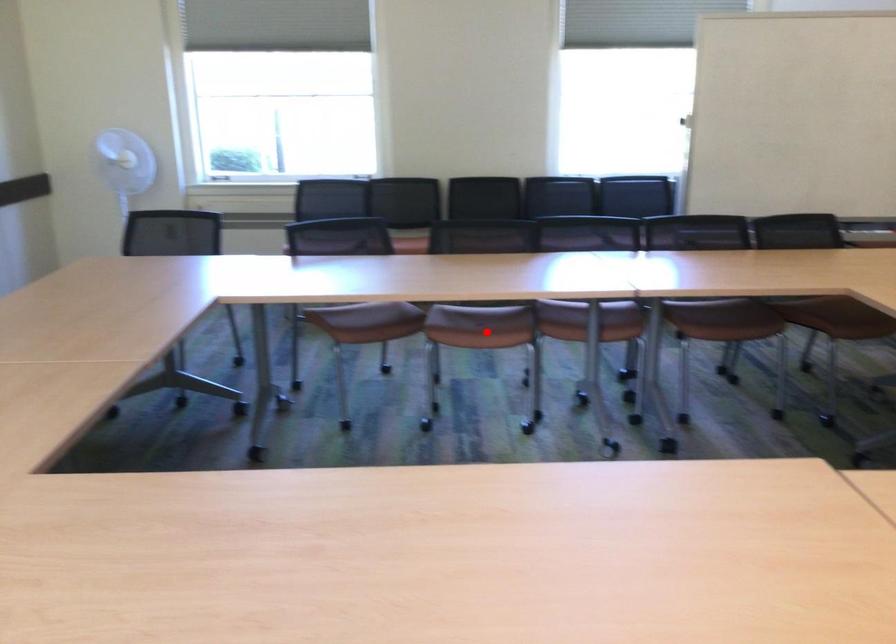
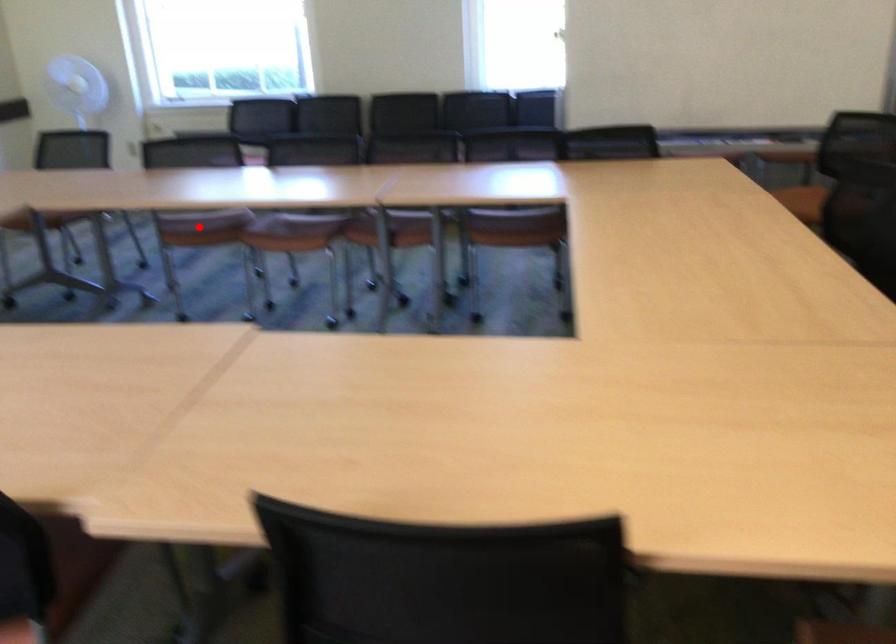
I am providing you with two images of the same scene from different viewpoints. A red point is marked on the first image and another point is marked on the second image. Is the red point in image1 aligned with the point shown in image2?

No